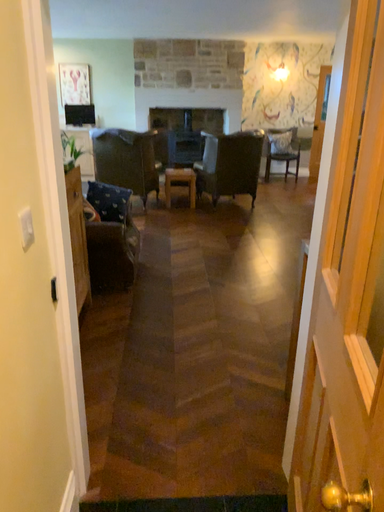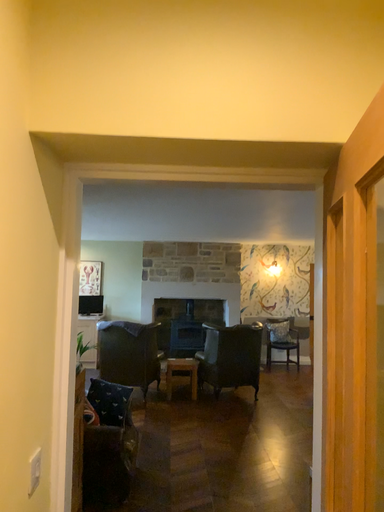
Question: How did the camera likely rotate when shooting the video?

Choices:
 (A) rotated upward
 (B) rotated downward

Answer: (A)